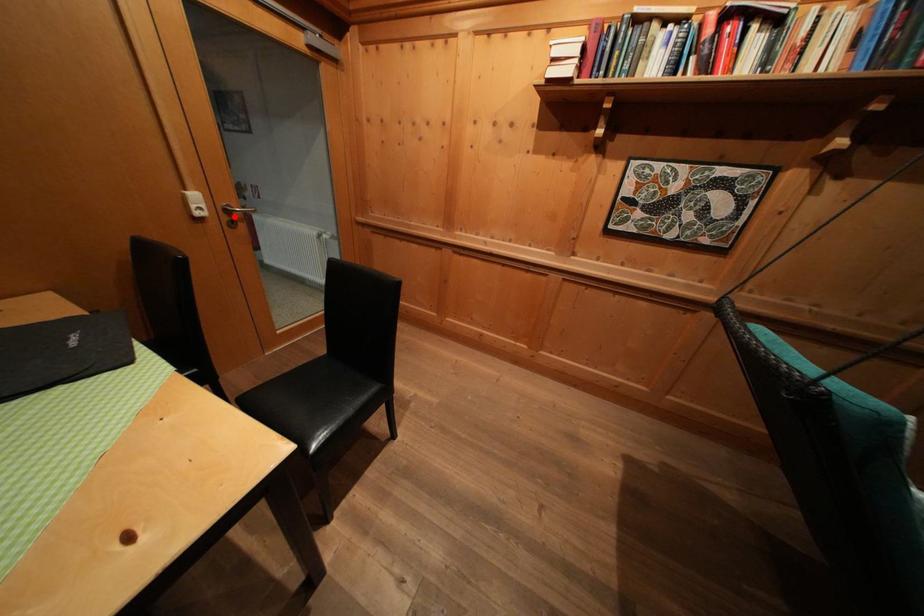
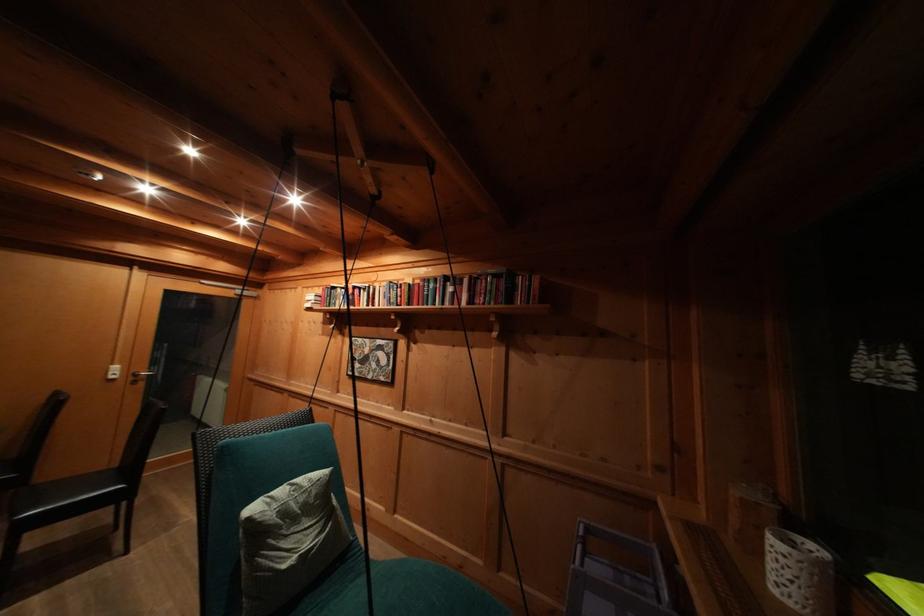
Where in the second image is the point corresponding to the highlighted location from the first image?

(141, 379)